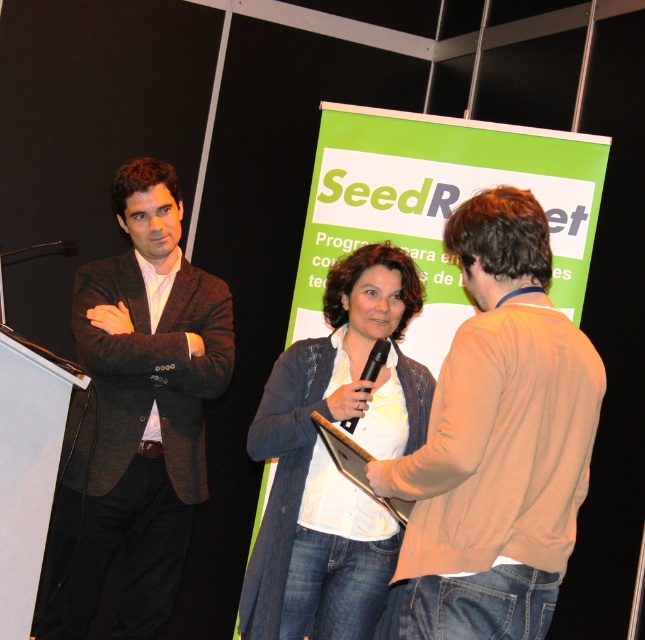
Is beige sweater at center to the right of white knitwear at center from the viewer's perspective?

Indeed, beige sweater at center is positioned on the right side of white knitwear at center.

Can you confirm if beige sweater at center is bigger than white knitwear at center?

No.

Between point (490, 310) and point (281, 436), which one is positioned behind?

The point (281, 436) is behind.

What are the coordinates of `beige sweater at center` in the screenshot? It's located at (495, 442).

Is white knitwear at center wider than black plastic microphone at center?

Yes, white knitwear at center is wider than black plastic microphone at center.

Is white knitwear at center above black plastic microphone at center?

No, white knitwear at center is not above black plastic microphone at center.

Is point (277, 625) less distant than point (348, 426)?

Yes.

At what (x,y) coordinates should I click in order to perform the action: click on white knitwear at center. Please return your answer as a coordinate pair (x, y). This screenshot has height=640, width=645. Looking at the image, I should click on (330, 461).

The image size is (645, 640). What do you see at coordinates (495, 442) in the screenshot? I see `beige sweater at center` at bounding box center [495, 442].

Which is behind, point (441, 625) or point (106, 397)?

The point (106, 397) is behind.

At what (x,y) coordinates should I click in order to perform the action: click on beige sweater at center. Please return your answer as a coordinate pair (x, y). The image size is (645, 640). Looking at the image, I should click on (495, 442).